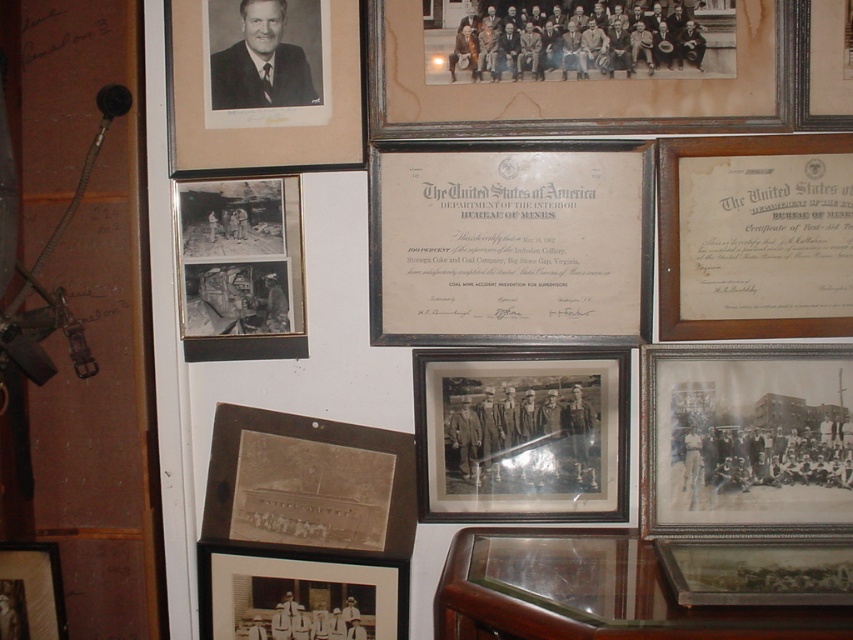
You are an art curator organizing an exhibition and need to hang two items from the image on a new wall. The items are the black matte photograph at lower right and the wooden certificate at upper right. Which item is shorter in height?

The black matte photograph at lower right is shorter than the wooden certificate at upper right.

You are an art installer who needs to hang a new painting that is 1 meter wide between the wooden frame at upper center and the matte black photo frame at lower left. Is there enough space between them to fit the painting?

The wooden frame at upper center is 81.62 centimeters away from the matte black photo frame at lower left. Since the painting is 1 meter wide, which is 100 centimeters, there is not enough space to fit it between them.

You are an art curator arranging a new exhibition. You need to place a new item between the black matte photograph at lower right and the wooden certificate at upper right. Where should you place the new item to ensure it is between them?

The new item should be placed between the black matte photograph at lower right and the wooden certificate at upper right. Since the black matte photograph at lower right is below the wooden certificate at upper right, the new item should be placed in the middle vertically between them.